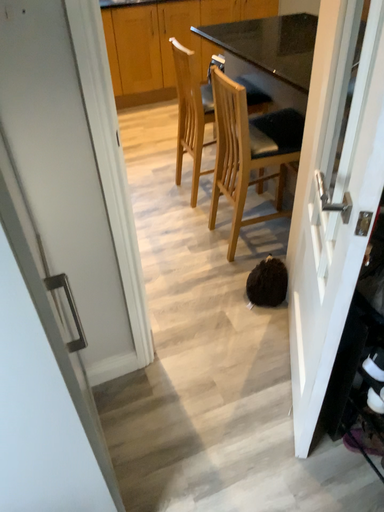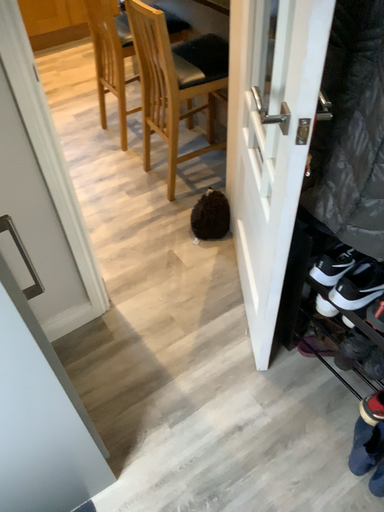
Question: Which way did the camera rotate in the video?

Choices:
 (A) rotated right
 (B) rotated left

Answer: (A)